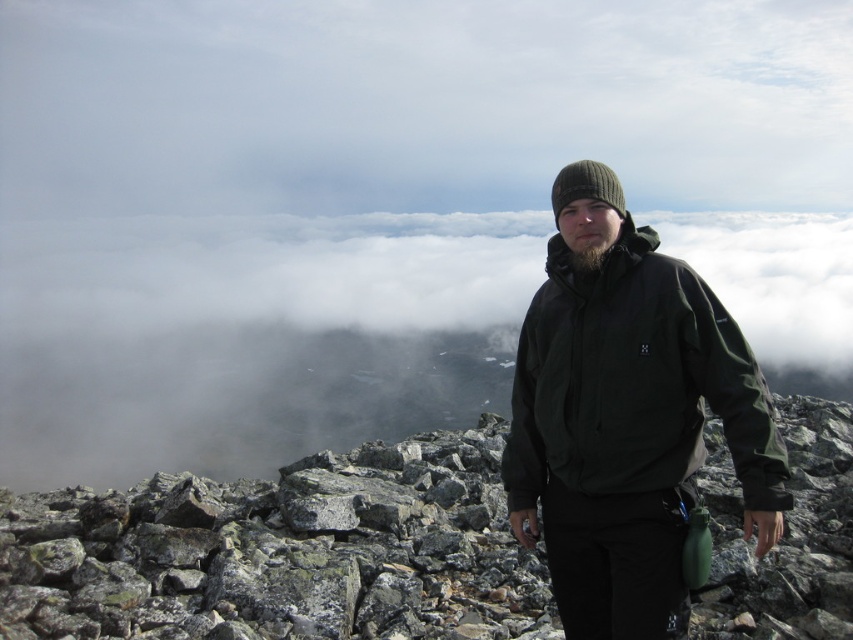
Question: From the image, what is the correct spatial relationship of gray rock pile at center in relation to dark green softshell jacket at center?

Choices:
 (A) below
 (B) above

Answer: (A)

Question: Which point is farther to the camera?

Choices:
 (A) (643, 372)
 (B) (422, 492)

Answer: (B)

Question: Is gray rock pile at center wider than dark green softshell jacket at center?

Choices:
 (A) no
 (B) yes

Answer: (A)

Question: Is gray rock pile at center bigger than dark green softshell jacket at center?

Choices:
 (A) no
 (B) yes

Answer: (A)

Question: Which point is farther to the camera?

Choices:
 (A) (775, 538)
 (B) (316, 566)

Answer: (B)